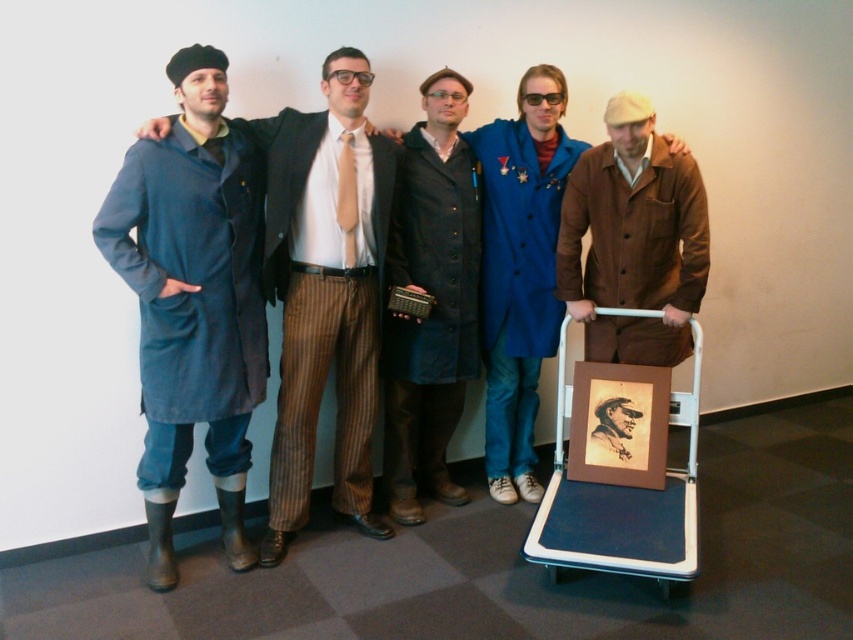
What is the position of the point labeled as point (526,214) in relation to the blue wool coat at center?

The point labeled as point (526,214) is located on the blue wool coat at center.

You are standing in front of the group and want to hand a gift to the person wearing the denim coat at left and the dark blue coat at center. Which one can you reach without moving closer?

The denim coat at left is closer to the viewer than the dark blue coat at center, so you can reach the person wearing the denim coat at left without moving closer.